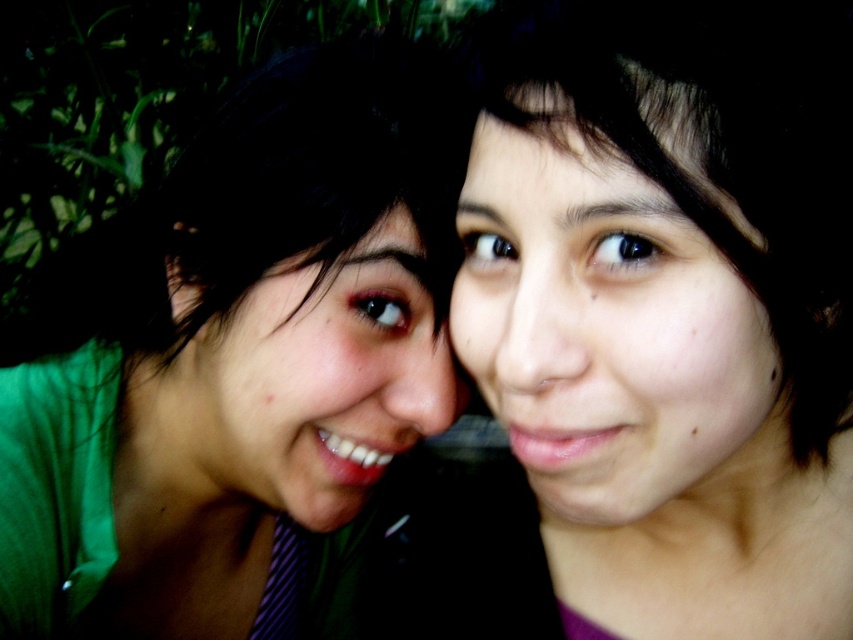
Does point (521, 410) lie in front of point (207, 352)?

That is True.

Can you confirm if smooth skin face at center is positioned above matte green shirt at center?

Correct, smooth skin face at center is located above matte green shirt at center.

Between point (738, 476) and point (392, 448), which one is positioned in front?

Point (738, 476) is more forward.

What are the coordinates of `smooth skin face at center` in the screenshot? It's located at (610, 332).

Can you confirm if green matte shirt at left is smaller than smooth skin face at center?

Incorrect, green matte shirt at left is not smaller in size than smooth skin face at center.

Where is `green matte shirt at left`? This screenshot has width=853, height=640. green matte shirt at left is located at coordinates [x=234, y=369].

Where is `green matte shirt at left`? green matte shirt at left is located at coordinates (234, 369).

Is green matte shirt at left to the right of matte green shirt at center from the viewer's perspective?

No, green matte shirt at left is not to the right of matte green shirt at center.

Measure the distance from green matte shirt at left to matte green shirt at center.

green matte shirt at left is 4.75 centimeters away from matte green shirt at center.

Who is more distant from viewer, (229, 624) or (410, 412)?

The point (229, 624) is more distant.

You are a GUI agent. You are given a task and a screenshot of the screen. Output one action in this format:
    pyautogui.click(x=<x>, y=<y>)
    Task: Click on the green matte shirt at left
    
    Given the screenshot: What is the action you would take?
    pyautogui.click(x=234, y=369)